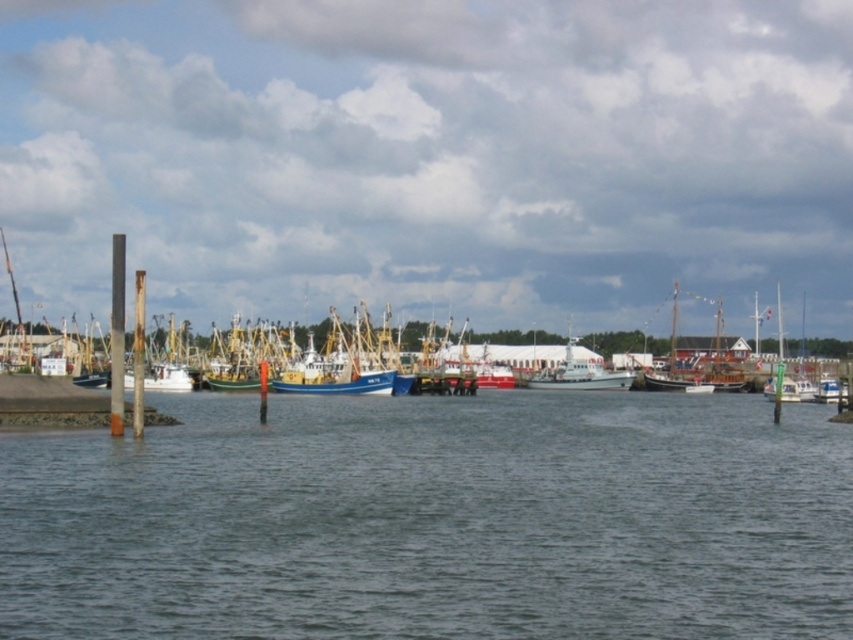
You are standing on the dock and want to locate the clear water at center. According to the coordinates provided, where should you look relative to the dock?

The clear water at center is located at coordinates point (434, 518), so you should look towards the center area of the image where the clear water is situated.

You are a harbor worker who needs to move a 90 feet long cargo container from the white matte boat at center to the blue matte boat at center. Can you safely transport it without the container overlapping both boats?

The white matte boat at center and blue matte boat at center are 90.54 feet apart from each other. Since the cargo container is 90 feet long, it can be transported safely as the distance between the boats is slightly longer than the container, allowing for safe placement without overlapping.